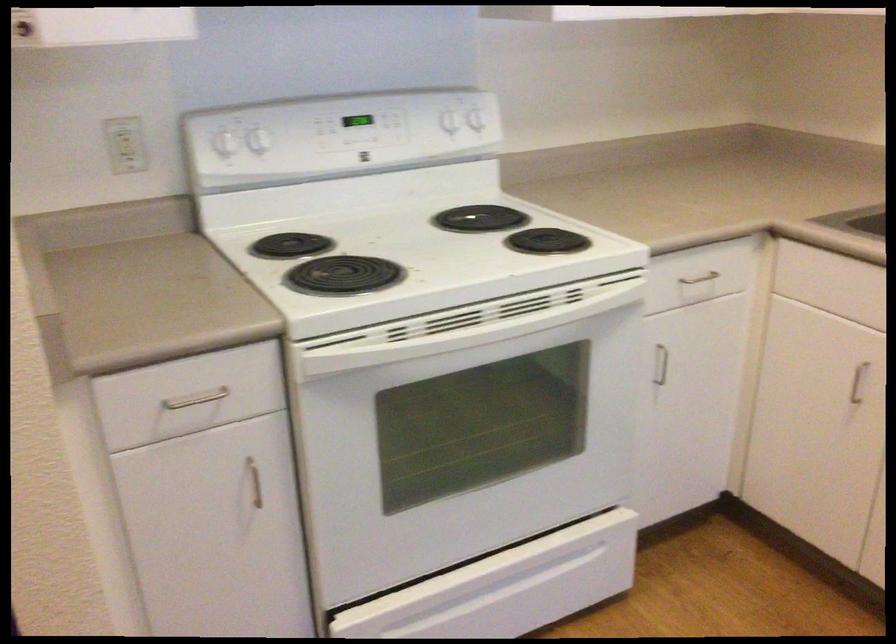
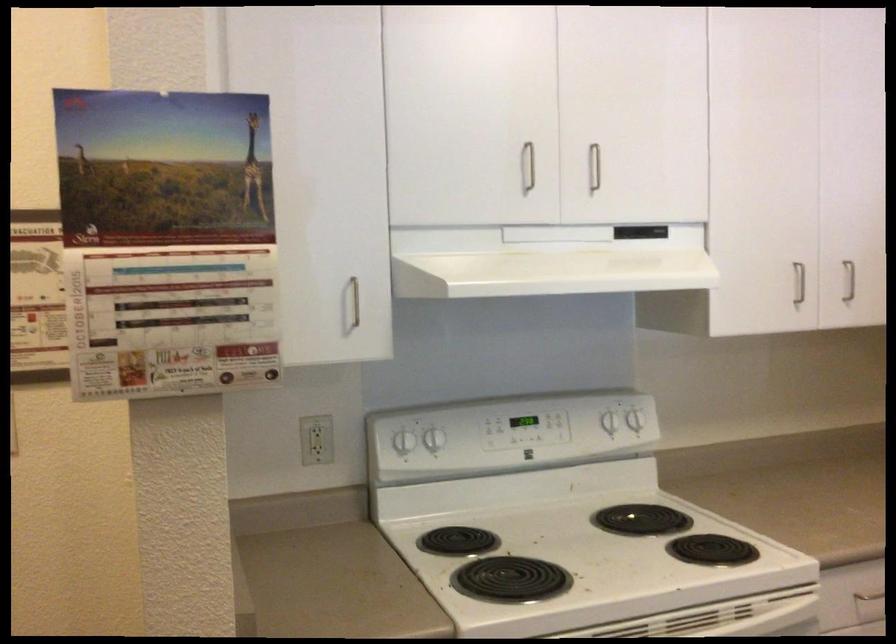
Find the pixel in the second image that matches the point at 478,118 in the first image.

(634, 420)